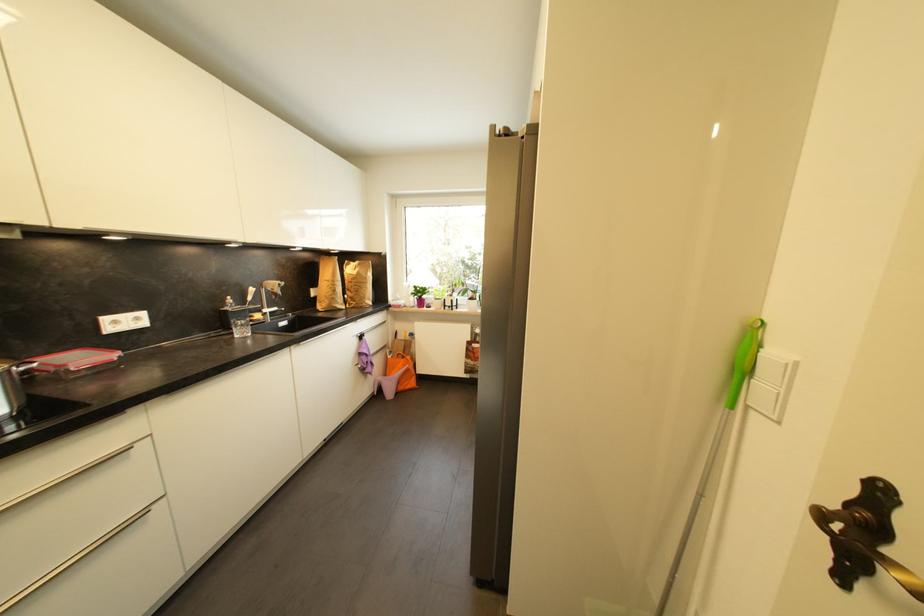
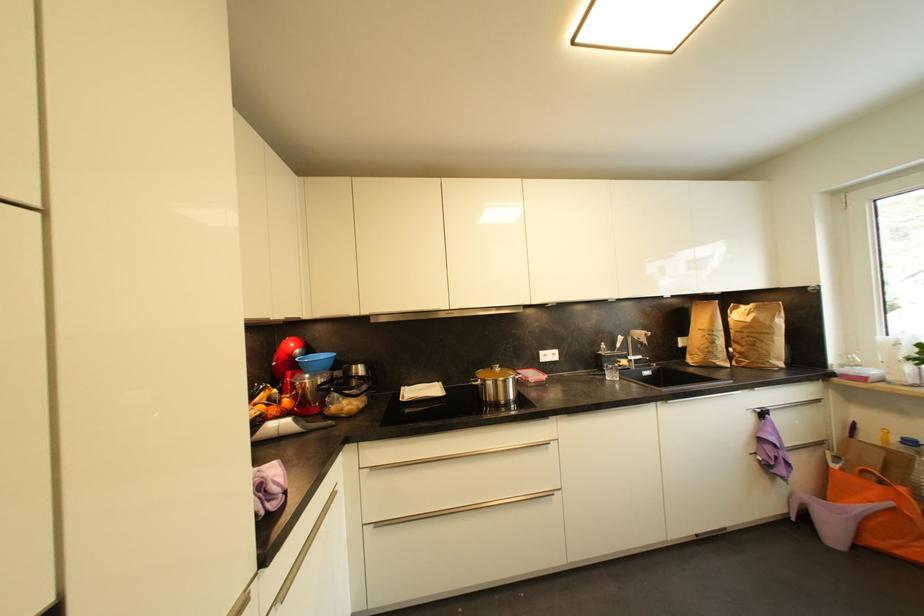
Find the pixel in the second image that matches point (390, 349) in the first image.

(825, 446)